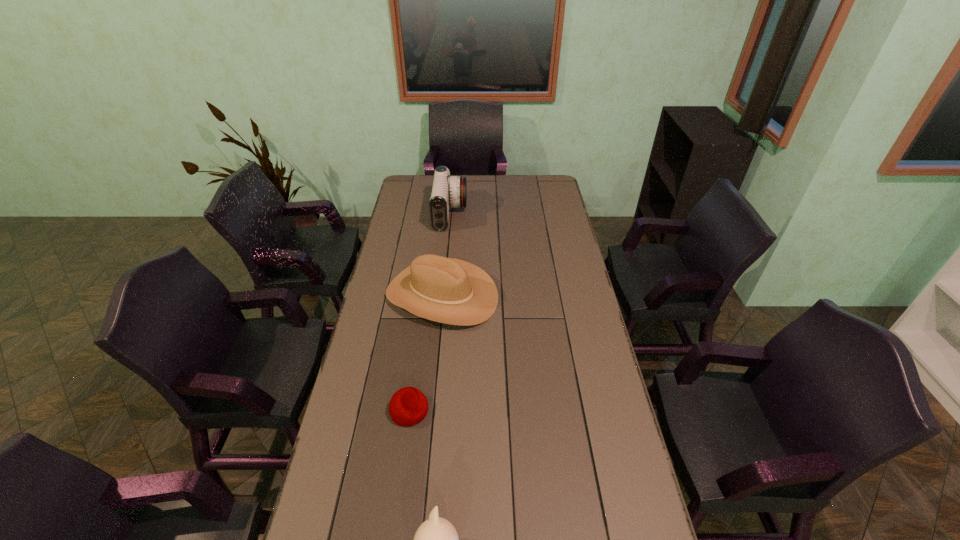
The width and height of the screenshot is (960, 540). I want to click on camcorder, so (x=447, y=191).

At what (x,y) coordinates should I click in order to perform the action: click on the farthest object. Please return your answer as a coordinate pair (x, y). This screenshot has height=540, width=960. Looking at the image, I should click on (447, 191).

Locate an element on the screen. The width and height of the screenshot is (960, 540). the third nearest object is located at coordinates (446, 290).

The image size is (960, 540). In order to click on the second tallest object in this screenshot , I will do `click(446, 290)`.

Locate an element on the screen. the shortest object is located at coordinates (408, 406).

Find the location of a particular element. The height and width of the screenshot is (540, 960). the second nearest object is located at coordinates pyautogui.click(x=408, y=406).

The height and width of the screenshot is (540, 960). What are the coordinates of `vacant point located on the surface of the tallest object` in the screenshot? It's located at (504, 214).

Identify the location of free space located on the front of the cowboy hat. This screenshot has height=540, width=960. (435, 364).

Identify the location of free region located 0.350m on the seat area of the second nearest object. This screenshot has width=960, height=540. (546, 410).

Find the location of a particular element. The height and width of the screenshot is (540, 960). cowboy hat located at the left edge is located at coordinates pos(446,290).